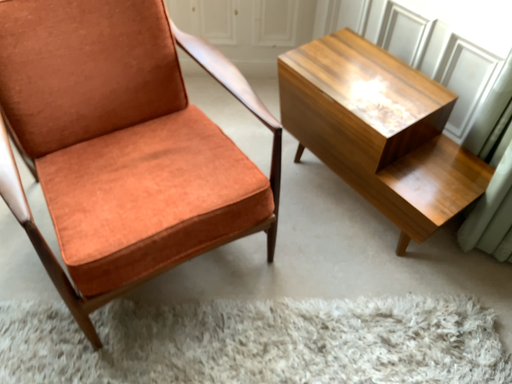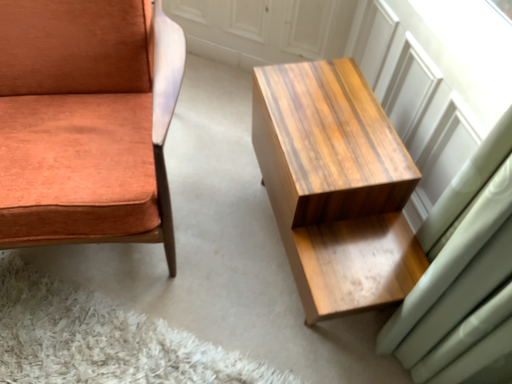
Question: Which way did the camera rotate in the video?

Choices:
 (A) rotated right
 (B) rotated left

Answer: (B)